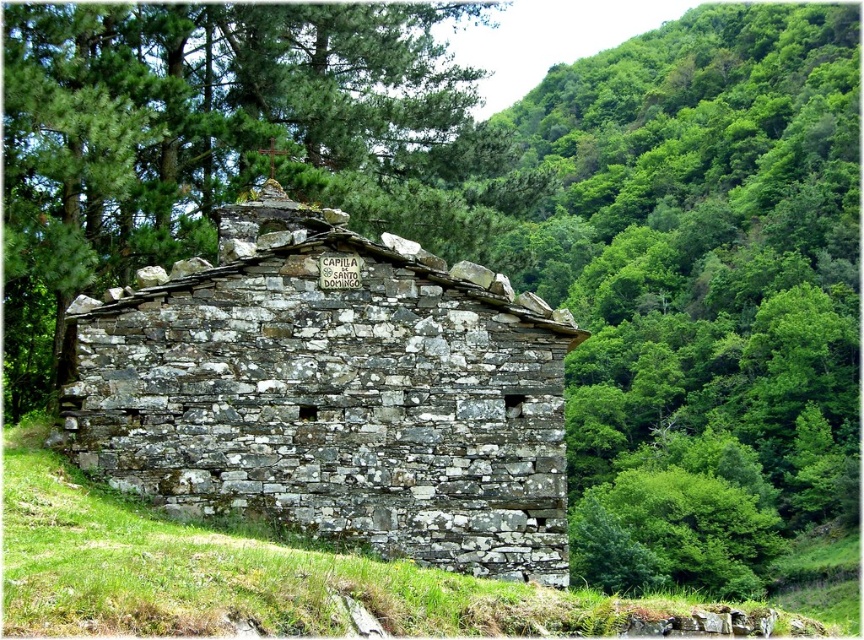
Does green leafy tree at upper center appear over gray stone wall at center?

Yes, green leafy tree at upper center is above gray stone wall at center.

Does green leafy tree at upper center have a smaller size compared to gray stone wall at center?

Correct, green leafy tree at upper center occupies less space than gray stone wall at center.

This screenshot has height=640, width=864. What do you see at coordinates (227, 141) in the screenshot?
I see `green leafy tree at upper center` at bounding box center [227, 141].

At what (x,y) coordinates should I click in order to perform the action: click on green leafy tree at upper center. Please return your answer as a coordinate pair (x, y). The height and width of the screenshot is (640, 864). Looking at the image, I should click on (227, 141).

Is point (340, 516) in front of point (149, 132)?

Yes, point (340, 516) is in front of point (149, 132).

Can you confirm if gray stone hut at center is smaller than green leafy tree at upper center?

Correct, gray stone hut at center occupies less space than green leafy tree at upper center.

Does point (469, 326) come farther from viewer compared to point (37, 403)?

No, it is not.

In order to click on gray stone hut at center in this screenshot , I will do `click(331, 392)`.

Does gray stone hut at center have a larger size compared to gray stone wall at center?

Actually, gray stone hut at center might be smaller than gray stone wall at center.

Between gray stone hut at center and gray stone wall at center, which one is positioned lower?

Positioned lower is gray stone wall at center.

At what (x,y) coordinates should I click in order to perform the action: click on gray stone hut at center. Please return your answer as a coordinate pair (x, y). The height and width of the screenshot is (640, 864). Looking at the image, I should click on (331, 392).